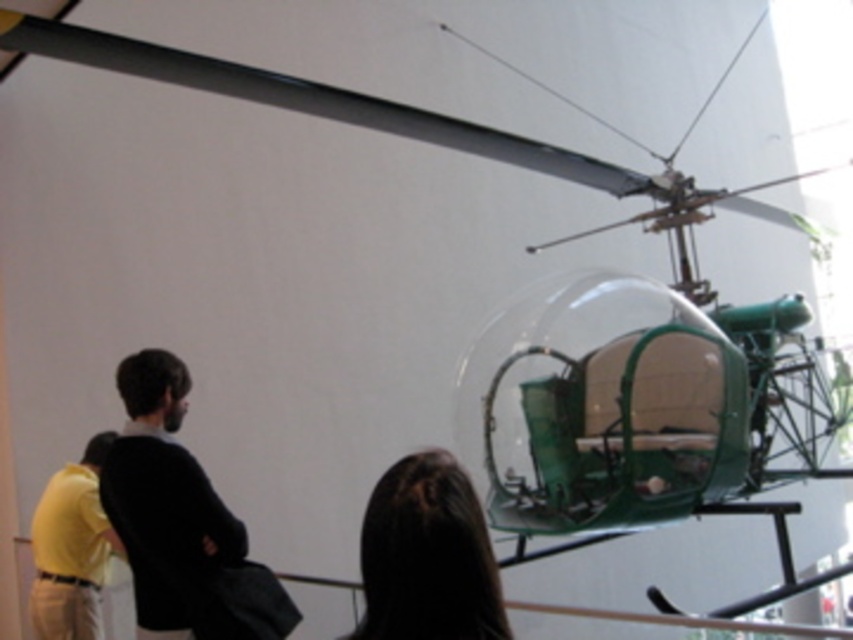
Question: Which object appears farthest from the camera in this image?

Choices:
 (A) dark brown leather jacket at left
 (B) dark brown hair at center
 (C) yellow matte shirt at lower left

Answer: (C)

Question: Among these points, which one is farthest from the camera?

Choices:
 (A) (151, 618)
 (B) (32, 548)
 (C) (398, 568)

Answer: (B)

Question: Estimate the real-world distances between objects in this image. Which object is farther from the yellow matte shirt at lower left?

Choices:
 (A) dark brown hair at center
 (B) dark brown leather jacket at left

Answer: (A)

Question: Is dark brown hair at center thinner than yellow matte shirt at lower left?

Choices:
 (A) yes
 (B) no

Answer: (A)

Question: Is dark brown leather jacket at left bigger than dark brown hair at center?

Choices:
 (A) yes
 (B) no

Answer: (A)

Question: Can you confirm if dark brown hair at center is positioned below yellow matte shirt at lower left?

Choices:
 (A) no
 (B) yes

Answer: (A)